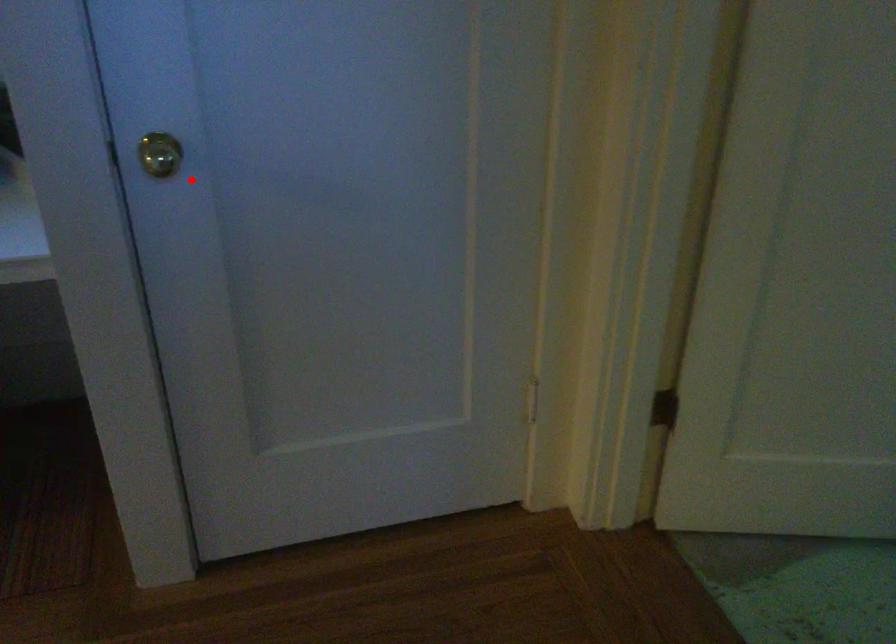
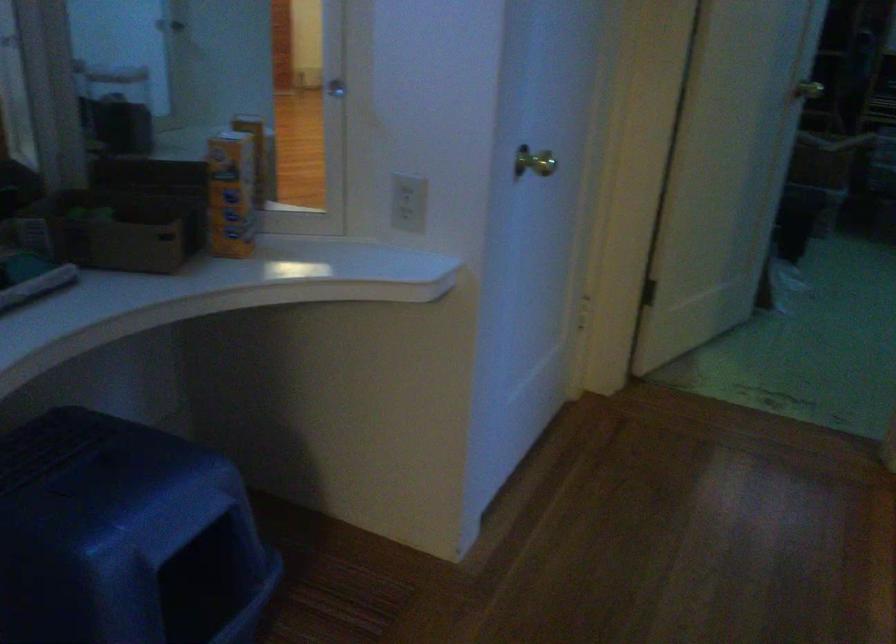
Where in the second image is the point corresponding to the highlighted location from the first image?

(533, 162)